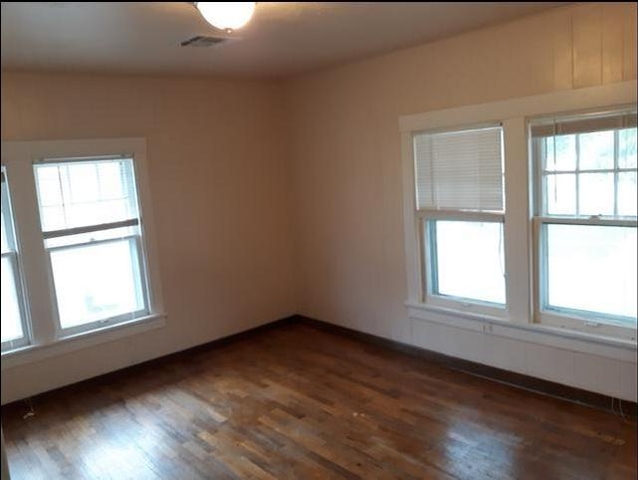
Where is `tan wall`? This screenshot has width=638, height=480. tan wall is located at coordinates (214, 237), (358, 204).